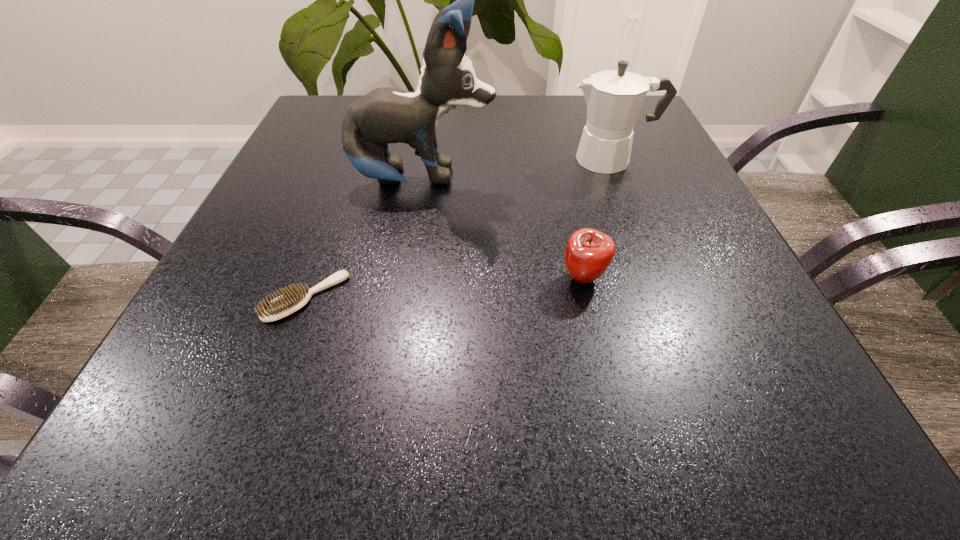
Locate an element on the screen. The image size is (960, 540). puppy that is at the left edge is located at coordinates (385, 115).

Identify the location of scrubbing brush that is at the left edge. The width and height of the screenshot is (960, 540). (292, 299).

The height and width of the screenshot is (540, 960). What are the coordinates of `object present at the right edge` in the screenshot? It's located at [614, 98].

The height and width of the screenshot is (540, 960). I want to click on free space at the far edge of the desktop, so click(x=531, y=126).

I want to click on vacant area at the near edge of the desktop, so click(x=655, y=454).

Identify the location of blank space at the left edge of the desktop. (334, 192).

Find the location of a particular element. vacant space at the right edge is located at coordinates (664, 153).

Locate an element on the screen. The width and height of the screenshot is (960, 540). free region at the far left corner of the desktop is located at coordinates (336, 130).

Image resolution: width=960 pixels, height=540 pixels. In order to click on free space between the shortest object and the tallest object in this screenshot , I will do `click(365, 239)`.

Locate an element on the screen. free space between the second shortest object and the shortest object is located at coordinates (444, 288).